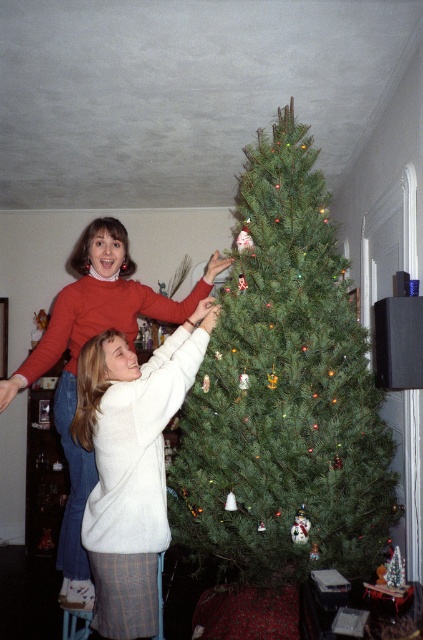
You are a decorator trying to place a new ornament on the green matte christmas tree at center. The ornament is 10 cm wide. To ensure it fits, you need to know if the tree is wider than the matte red sweater at upper left. Can you determine this?

The green matte christmas tree at center might be wider than matte red sweater at upper left, so there is a possibility that the ornament will fit, but it is uncertain.

You are standing in the room and want to hand an ornament to the person wearing the matte red sweater at upper left. The ornament is currently on the green matte christmas tree at center. Which object is closer to you so you can reach it first?

The green matte christmas tree at center is closer to you than the matte red sweater at upper left, so you can reach the ornament on the green matte christmas tree at center first before handing it to the person.

You are a guest at the holiday party and want to take a photo with the green matte christmas tree at center and the matte red sweater at upper left. Since you want to include both in the frame, which object should you position closer to the camera to ensure both fit well?

The green matte christmas tree at center is larger than the matte red sweater at upper left. To include both in the frame, position the smaller matte red sweater at upper left closer to the camera so that its size in the photo matches the larger tree in the background.